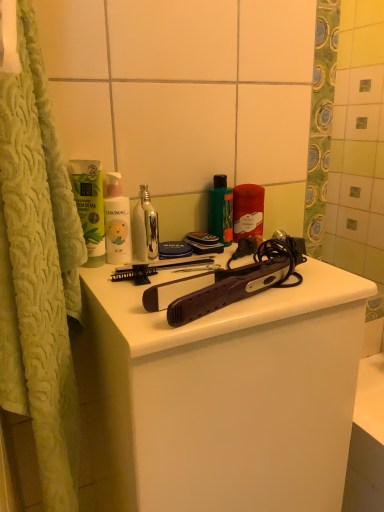
Describe the element at coordinates (248, 210) in the screenshot. I see `matte red candle at center, arranged as the 2th cleaning product when viewed from the left` at that location.

The width and height of the screenshot is (384, 512). Identify the location of green matte tube at upper left, placed as the first mouthwash when sorted from left to right. (90, 207).

The width and height of the screenshot is (384, 512). What are the coordinates of `white matte bottle at center, which ranks as the first cleaning product in left-to-right order` in the screenshot? It's located at (116, 221).

Considering the positions of point (256, 190) and point (229, 210), is point (256, 190) closer or farther from the camera than point (229, 210)?

Point (256, 190).

Is matte red candle at center, acting as the 2th cleaning product starting from the front, inside or outside of green glossy bottle at center, which is counted as the first mouthwash, starting from the right?

The correct answer is: outside.

Locate an element on the screen. cleaning product behind the green glossy bottle at center, which is counted as the first mouthwash, starting from the right is located at coordinates (248, 210).

Is matte red candle at center, marked as the 1th cleaning product in a right-to-left arrangement, bigger or smaller than metallic silver bottle at center, arranged as the second mouthwash when viewed from the left?

matte red candle at center, marked as the 1th cleaning product in a right-to-left arrangement, is bigger than metallic silver bottle at center, arranged as the second mouthwash when viewed from the left.

Between matte red candle at center, the first cleaning product viewed from the back, and metallic silver bottle at center, arranged as the second mouthwash when viewed from the left, which one has smaller width?

With smaller width is matte red candle at center, the first cleaning product viewed from the back.

Based on the photo, relative to metallic silver bottle at center, arranged as the second mouthwash when viewed from the left, is matte red candle at center, the first cleaning product viewed from the back, in front or behind?

Visually, matte red candle at center, the first cleaning product viewed from the back, is located behind metallic silver bottle at center, arranged as the second mouthwash when viewed from the left.

Is green matte tube at upper left, which ranks as the 3th mouthwash in right-to-left order, far from white matte bottle at center, which is the 2th cleaning product in right-to-left order?

No, there isn't a large distance between green matte tube at upper left, which ranks as the 3th mouthwash in right-to-left order, and white matte bottle at center, which is the 2th cleaning product in right-to-left order.

Consider the image. Which of these two, green matte tube at upper left, which ranks as the 3th mouthwash in right-to-left order, or white matte bottle at center, which ranks as the first cleaning product in left-to-right order, is thinner?

green matte tube at upper left, which ranks as the 3th mouthwash in right-to-left order.

From the image's perspective, would you say green matte tube at upper left, which ranks as the 3th mouthwash in right-to-left order, is shown under white matte bottle at center, the first cleaning product positioned from the front?

Incorrect, from the image's perspective, green matte tube at upper left, which ranks as the 3th mouthwash in right-to-left order, is higher than white matte bottle at center, the first cleaning product positioned from the front.

How different are the orientations of green matte tube at upper left, which ranks as the 3th mouthwash in right-to-left order, and white matte bottle at center, the first cleaning product positioned from the front, in degrees?

0.000115 degrees separate the facing orientations of green matte tube at upper left, which ranks as the 3th mouthwash in right-to-left order, and white matte bottle at center, the first cleaning product positioned from the front.

Is metallic silver bottle at center, the second mouthwash when ordered from right to left, positioned with its back to matte red candle at center, arranged as the 2th cleaning product when viewed from the left?

metallic silver bottle at center, the second mouthwash when ordered from right to left, does not have its back to matte red candle at center, arranged as the 2th cleaning product when viewed from the left.

Which object is closer to the camera taking this photo, metallic silver bottle at center, arranged as the second mouthwash when viewed from the left, or matte red candle at center, arranged as the 2th cleaning product when viewed from the left?

metallic silver bottle at center, arranged as the second mouthwash when viewed from the left, is more forward.

Are metallic silver bottle at center, arranged as the second mouthwash when viewed from the left, and matte red candle at center, the first cleaning product viewed from the back, beside each other?

No, metallic silver bottle at center, arranged as the second mouthwash when viewed from the left, is not making contact with matte red candle at center, the first cleaning product viewed from the back.

From the image's perspective, does metallic silver bottle at center, the second mouthwash when ordered from right to left, appear lower than matte red candle at center, acting as the 2th cleaning product starting from the front?

Yes.

From the image's perspective, which one is positioned lower, matte black hair straightener at center or matte red candle at center, the first cleaning product viewed from the back?

From the image's view, matte black hair straightener at center is below.

Which point is more forward, (87, 287) or (263, 190)?

Positioned in front is point (87, 287).

Is matte black hair straightener at center facing towards matte red candle at center, the first cleaning product viewed from the back?

No, matte black hair straightener at center is not facing towards matte red candle at center, the first cleaning product viewed from the back.

Who is shorter, matte black hair straightener at center or matte red candle at center, acting as the 2th cleaning product starting from the front?

Standing shorter between the two is matte red candle at center, acting as the 2th cleaning product starting from the front.

Is metallic silver bottle at center, the second mouthwash when ordered from right to left, wider than white matte bottle at center, which is the 2th cleaning product in back-to-front order?

Indeed, metallic silver bottle at center, the second mouthwash when ordered from right to left, has a greater width compared to white matte bottle at center, which is the 2th cleaning product in back-to-front order.

From a real-world perspective, is metallic silver bottle at center, the second mouthwash when ordered from right to left, physically located above or below white matte bottle at center, which ranks as the first cleaning product in left-to-right order?

Clearly, from a real-world perspective, metallic silver bottle at center, the second mouthwash when ordered from right to left, is below white matte bottle at center, which ranks as the first cleaning product in left-to-right order.

Is metallic silver bottle at center, the second mouthwash when ordered from right to left, taller than white matte bottle at center, which ranks as the first cleaning product in left-to-right order?

No.

Considering the sizes of objects metallic silver bottle at center, arranged as the second mouthwash when viewed from the left, and white matte bottle at center, which is the 2th cleaning product in back-to-front order, in the image provided, who is smaller, metallic silver bottle at center, arranged as the second mouthwash when viewed from the left, or white matte bottle at center, which is the 2th cleaning product in back-to-front order,?

metallic silver bottle at center, arranged as the second mouthwash when viewed from the left, is smaller.

Is green glossy bottle at center, which appears as the third mouthwash when viewed from the left, positioned with its back to green matte tube at upper left, which ranks as the 3th mouthwash in right-to-left order?

green glossy bottle at center, which appears as the third mouthwash when viewed from the left, does not have its back to green matte tube at upper left, which ranks as the 3th mouthwash in right-to-left order.

Which is in front, point (226, 210) or point (78, 180)?

The point (78, 180) is closer to the camera.

Looking at their sizes, would you say green glossy bottle at center, which appears as the third mouthwash when viewed from the left, is wider or thinner than green matte tube at upper left, placed as the first mouthwash when sorted from left to right?

Clearly, green glossy bottle at center, which appears as the third mouthwash when viewed from the left, has more width compared to green matte tube at upper left, placed as the first mouthwash when sorted from left to right.

Based on their positions, is green glossy bottle at center, which is counted as the first mouthwash, starting from the right, located to the left or right of green matte tube at upper left, placed as the first mouthwash when sorted from left to right?

Based on their positions, green glossy bottle at center, which is counted as the first mouthwash, starting from the right, is located to the right of green matte tube at upper left, placed as the first mouthwash when sorted from left to right.

From the matte red candle at center, arranged as the 2th cleaning product when viewed from the left, count 1st mouthwashs forward and point to it. Please provide its 2D coordinates.

[(221, 210)]

There is a matte red candle at center, the first cleaning product viewed from the back. Where is `the 1st mouthwash above it (from a real-world perspective)`? the 1st mouthwash above it (from a real-world perspective) is located at coordinates (145, 228).

From the image, which object appears to be nearer to metallic silver bottle at center, arranged as the second mouthwash when viewed from the left, matte red candle at center, marked as the 1th cleaning product in a right-to-left arrangement, or matte black hair straightener at center?

matte red candle at center, marked as the 1th cleaning product in a right-to-left arrangement, is closer to metallic silver bottle at center, arranged as the second mouthwash when viewed from the left.

When comparing their distances from green matte tube at upper left, placed as the first mouthwash when sorted from left to right, does metallic silver bottle at center, the second mouthwash when ordered from right to left, or matte red candle at center, acting as the 2th cleaning product starting from the front, seem closer?

metallic silver bottle at center, the second mouthwash when ordered from right to left, is positioned closer to the anchor green matte tube at upper left, placed as the first mouthwash when sorted from left to right.

Based on their spatial positions, is green glossy bottle at center, which appears as the third mouthwash when viewed from the left, or matte black hair straightener at center further from white matte bottle at center, the first cleaning product positioned from the front?

Based on the image, matte black hair straightener at center appears to be further to white matte bottle at center, the first cleaning product positioned from the front.

Estimate the real-world distances between objects in this image. Which object is closer to green glossy bottle at center, which is counted as the first mouthwash, starting from the right, green matte tube at upper left, placed as the first mouthwash when sorted from left to right, or white matte bottle at center, the first cleaning product positioned from the front?

Among the two, white matte bottle at center, the first cleaning product positioned from the front, is located nearer to green glossy bottle at center, which is counted as the first mouthwash, starting from the right.

Which object lies further to the anchor point matte red candle at center, arranged as the 2th cleaning product when viewed from the left, metallic silver bottle at center, the second mouthwash when ordered from right to left, or green matte tube at upper left, which ranks as the 3th mouthwash in right-to-left order?

green matte tube at upper left, which ranks as the 3th mouthwash in right-to-left order.

Looking at the image, which one is located further to green matte tube at upper left, placed as the first mouthwash when sorted from left to right, green glossy bottle at center, which is counted as the first mouthwash, starting from the right, or metallic silver bottle at center, arranged as the second mouthwash when viewed from the left?

Among the two, green glossy bottle at center, which is counted as the first mouthwash, starting from the right, is located further to green matte tube at upper left, placed as the first mouthwash when sorted from left to right.

Considering their positions, is matte black hair straightener at center positioned further to white matte bottle at center, which is the 2th cleaning product in right-to-left order, than metallic silver bottle at center, arranged as the second mouthwash when viewed from the left?

The object further to white matte bottle at center, which is the 2th cleaning product in right-to-left order, is matte black hair straightener at center.

When comparing their distances from green glossy bottle at center, which is counted as the first mouthwash, starting from the right, does white matte bottle at center, which is the 2th cleaning product in back-to-front order, or matte red candle at center, arranged as the 2th cleaning product when viewed from the left, seem further?

white matte bottle at center, which is the 2th cleaning product in back-to-front order.

Where is `mouthwash located between green matte tube at upper left, placed as the first mouthwash when sorted from left to right, and green glossy bottle at center, which appears as the third mouthwash when viewed from the left, in the left-right direction`? The image size is (384, 512). mouthwash located between green matte tube at upper left, placed as the first mouthwash when sorted from left to right, and green glossy bottle at center, which appears as the third mouthwash when viewed from the left, in the left-right direction is located at coordinates (145, 228).

Identify the location of cleaning product between green matte tube at upper left, placed as the first mouthwash when sorted from left to right, and green glossy bottle at center, which is counted as the first mouthwash, starting from the right, from left to right. This screenshot has width=384, height=512. (116, 221).

You are a GUI agent. You are given a task and a screenshot of the screen. Output one action in this format:
    pyautogui.click(x=<x>, y=<y>)
    Task: Click on the cleaning product located between green matte tube at upper left, placed as the first mouthwash when sorted from left to right, and matte red candle at center, acting as the 2th cleaning product starting from the front, in the left-right direction
    The image size is (384, 512).
    Given the screenshot: What is the action you would take?
    pyautogui.click(x=116, y=221)

Where is `mouthwash between white matte bottle at center, which is the 2th cleaning product in back-to-front order, and matte black hair straightener at center from top to bottom`? mouthwash between white matte bottle at center, which is the 2th cleaning product in back-to-front order, and matte black hair straightener at center from top to bottom is located at coordinates (145, 228).